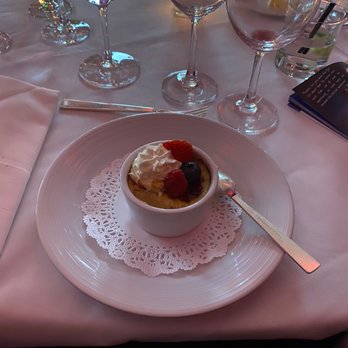
Image resolution: width=348 pixels, height=348 pixels. Identify the location of bowl. (x=176, y=220).